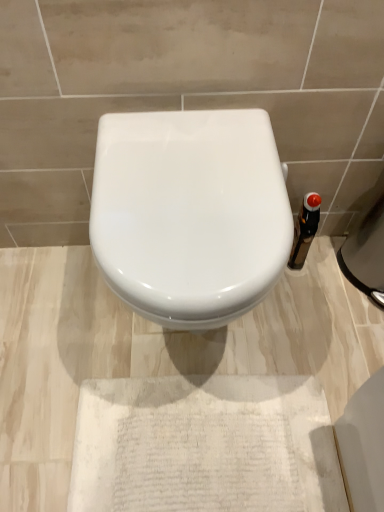
Identify the location of free space above white glossy toilet at center (from a real-world perspective). (175, 169).